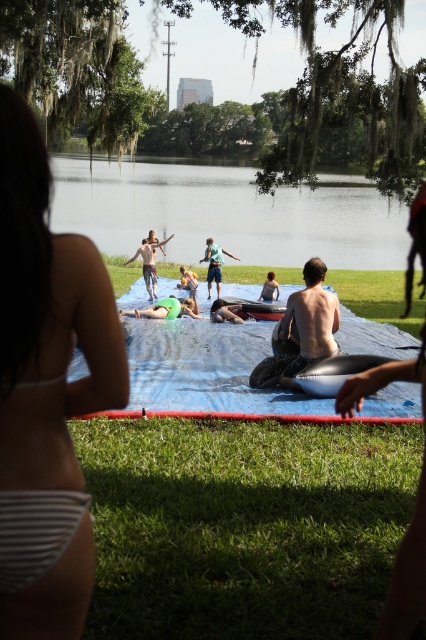
You are standing at the point with coordinates [244,525] in the image. What is the color of the ground beneath your feet?

The ground beneath your feet at point [244,525] is green grass at lower center.

You are a photographer wanting to capture the slip and slide scene. You notice the green grass at lower center and the light blue fabric at center. Which object is positioned lower in the image?

The green grass at lower center is positioned lower in the image than the light blue fabric at center.